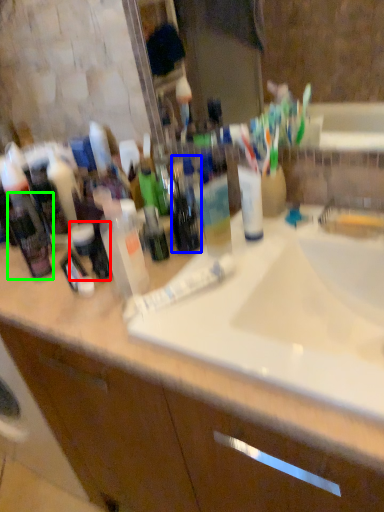
Question: Considering the real-world distances, which object is farthest from toiletry (highlighted by a red box)? bottle (highlighted by a blue box) or toiletry (highlighted by a green box)?

Choices:
 (A) bottle
 (B) toiletry

Answer: (A)